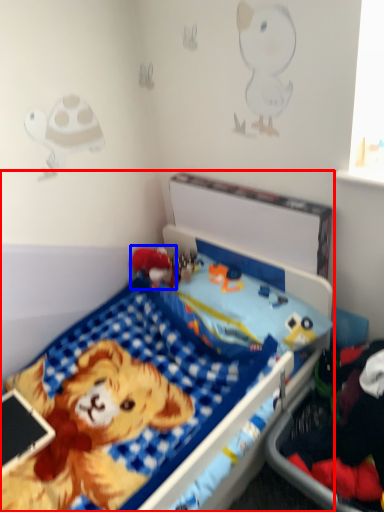
Question: Among these objects, which one is nearest to the camera, bed (highlighted by a red box) or toy (highlighted by a blue box)?

Choices:
 (A) bed
 (B) toy

Answer: (A)